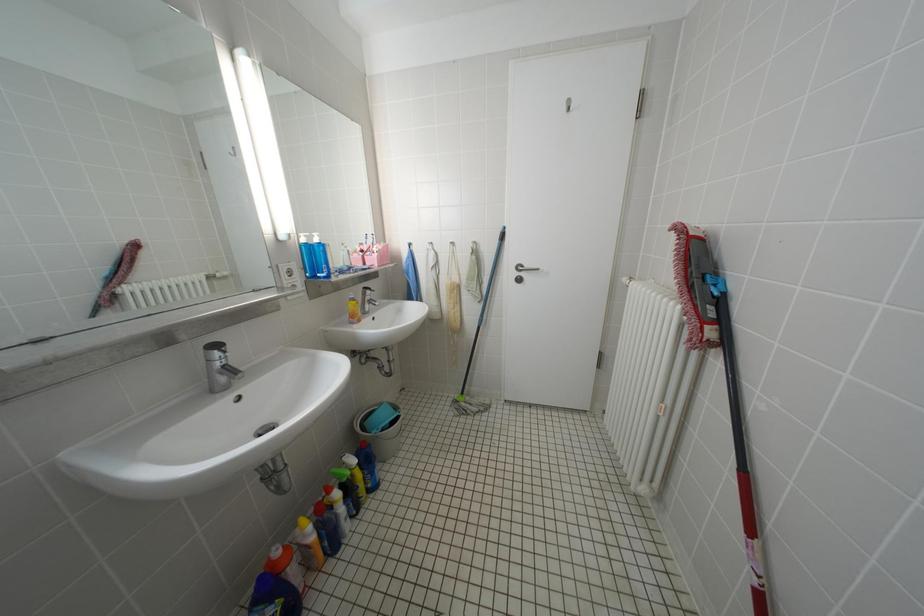
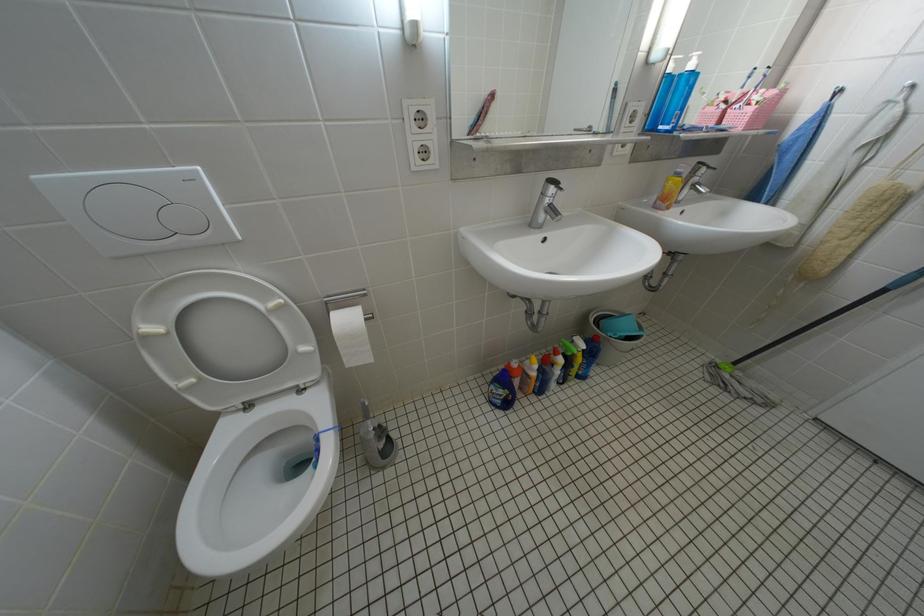
How did the camera likely rotate?

The rotation direction of the camera is left-down.